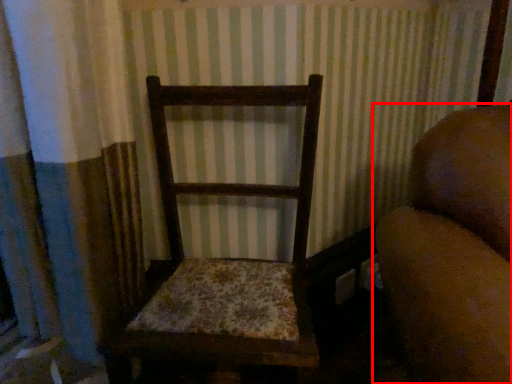
Question: Where is furniture (annotated by the red box) located in relation to rocking chair in the image?

Choices:
 (A) right
 (B) left

Answer: (A)